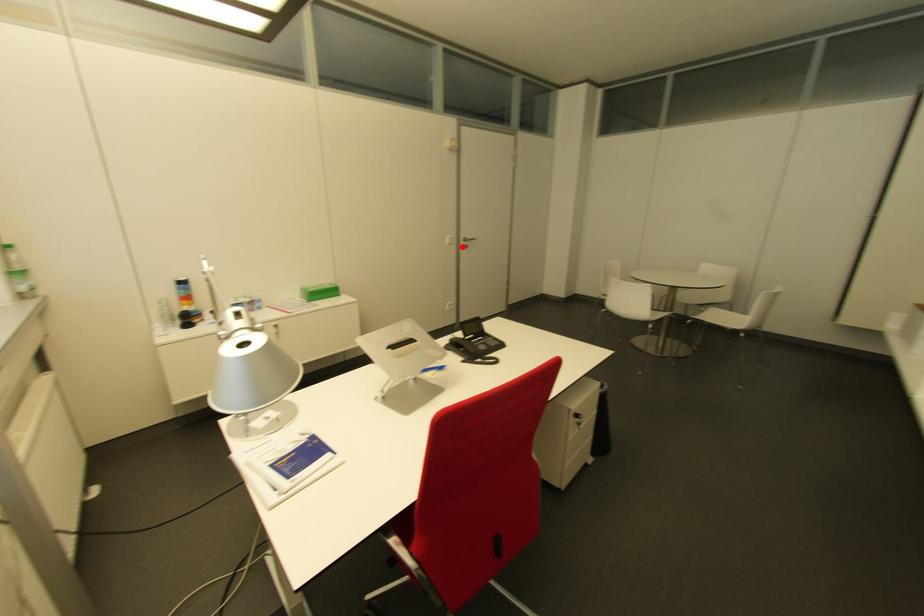
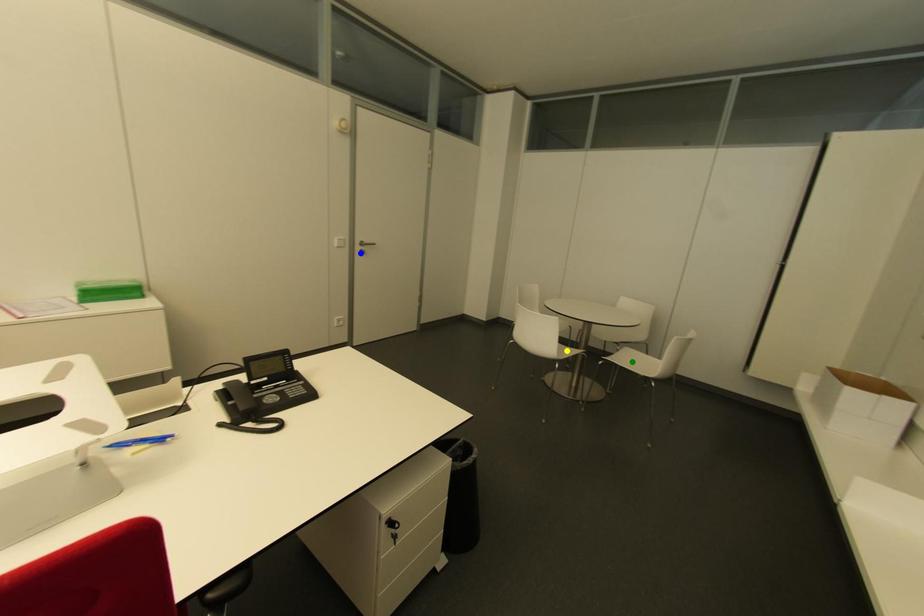
Question: I am providing you with two images of the same scene from different viewpoints. A red point is marked on the first image. You are given multiple points on the second image. Which point in image 2 is actually the same real-world point as the red point in image 1?

Choices:
 (A) green point
 (B) yellow point
 (C) blue point

Answer: (C)